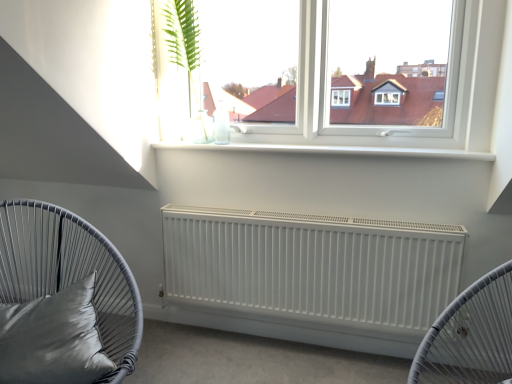
Identify the location of green leafy plant at upper center. (183, 38).

What is the approximate height of satin gray pillow at lower left?

The height of satin gray pillow at lower left is 11.37 inches.

What do you see at coordinates (53, 339) in the screenshot?
I see `satin gray pillow at lower left` at bounding box center [53, 339].

Where is `green leafy plant at upper center`? green leafy plant at upper center is located at coordinates (183, 38).

Is matte gray cushion at left not within satin gray pillow at lower left?

Yes, matte gray cushion at left is outside of satin gray pillow at lower left.

Which is more distant, (6, 226) or (0, 346)?

The point (6, 226) is more distant.

Considering the sizes of matte gray cushion at left and satin gray pillow at lower left in the image, is matte gray cushion at left wider or thinner than satin gray pillow at lower left?

Clearly, matte gray cushion at left has more width compared to satin gray pillow at lower left.

Is green leafy plant at upper center surrounded by matte gray cushion at left?

No, green leafy plant at upper center is not a part of matte gray cushion at left.

Is point (120, 365) behind point (180, 41)?

That is False.

Find the location of `furniture located on the left of green leafy plant at upper center`. furniture located on the left of green leafy plant at upper center is located at coordinates 71,273.

How many degrees apart are the facing directions of matte gray cushion at left and green leafy plant at upper center?

A: 48.2 degrees.

From a real-world perspective, which is physically above, green leafy plant at upper center or satin gray pillow at lower left?

In real-world perspective, green leafy plant at upper center is above.

Is green leafy plant at upper center thinner than satin gray pillow at lower left?

Indeed, green leafy plant at upper center has a lesser width compared to satin gray pillow at lower left.

Between green leafy plant at upper center and satin gray pillow at lower left, which one is positioned behind?

Positioned behind is green leafy plant at upper center.

Can you tell me how much green leafy plant at upper center and satin gray pillow at lower left differ in facing direction?

The facing directions of green leafy plant at upper center and satin gray pillow at lower left are 37 degrees apart.

Measure the distance from satin gray pillow at lower left to matte gray cushion at left.

The distance of satin gray pillow at lower left from matte gray cushion at left is 5.60 inches.

From a real-world perspective, which object stands above the other?

satin gray pillow at lower left, from a real-world perspective.

Is satin gray pillow at lower left oriented towards matte gray cushion at left?

Yes, satin gray pillow at lower left is turned towards matte gray cushion at left.

From the image's perspective, is satin gray pillow at lower left located above matte gray cushion at left?

Yes, from the image's perspective, satin gray pillow at lower left is on top of matte gray cushion at left.

Considering the relative sizes of white matte radiator at center and matte gray cushion at left in the image provided, is white matte radiator at center smaller than matte gray cushion at left?

Correct, white matte radiator at center occupies less space than matte gray cushion at left.

Does point (345, 243) lie in front of point (52, 292)?

No, (345, 243) is behind (52, 292).

Considering the relative sizes of white matte radiator at center and matte gray cushion at left in the image provided, is white matte radiator at center wider than matte gray cushion at left?

Incorrect, the width of white matte radiator at center does not surpass that of matte gray cushion at left.

Is matte gray cushion at left completely or partially inside white matte radiator at center?

Definitely not — matte gray cushion at left is not inside white matte radiator at center.

From the image's perspective, is green leafy plant at upper center over white matte radiator at center?

Yes, from the image's perspective, green leafy plant at upper center is over white matte radiator at center.

Can you tell me how much green leafy plant at upper center and white matte radiator at center differ in facing direction?

Result: The angle between the facing direction of green leafy plant at upper center and the facing direction of white matte radiator at center is 0.515 degrees.

At what (x,y) coordinates should I click in order to perform the action: click on plant above the white matte radiator at center (from a real-world perspective). Please return your answer as a coordinate pair (x, y). This screenshot has width=512, height=384. Looking at the image, I should click on (183, 38).

Can you confirm if green leafy plant at upper center is shorter than white matte radiator at center?

Incorrect, the height of green leafy plant at upper center does not fall short of that of white matte radiator at center.

From the image's perspective, is green leafy plant at upper center under matte gray cushion at left?

No, from the image's perspective, green leafy plant at upper center is not below matte gray cushion at left.

Is green leafy plant at upper center surrounding matte gray cushion at left?

No.

From the picture: Considering the relative sizes of green leafy plant at upper center and matte gray cushion at left in the image provided, is green leafy plant at upper center thinner than matte gray cushion at left?

Indeed, green leafy plant at upper center has a lesser width compared to matte gray cushion at left.

Is green leafy plant at upper center far from matte gray cushion at left?

green leafy plant at upper center is positioned a significant distance from matte gray cushion at left.

Locate an element on the screen. Image resolution: width=512 pixels, height=384 pixels. furniture below the satin gray pillow at lower left (from a real-world perspective) is located at coordinates (71, 273).

This screenshot has width=512, height=384. Identify the location of plant that appears above the matte gray cushion at left (from the image's perspective). (183, 38).

Based on their spatial positions, is white matte radiator at center or satin gray pillow at lower left further from matte gray cushion at left?

white matte radiator at center is further to matte gray cushion at left.

Considering their positions, is matte gray cushion at left positioned closer to green leafy plant at upper center than satin gray pillow at lower left?

matte gray cushion at left is closer to green leafy plant at upper center.

Considering their positions, is white matte radiator at center positioned further to satin gray pillow at lower left than matte gray cushion at left?

white matte radiator at center is positioned further to the anchor satin gray pillow at lower left.

Estimate the real-world distances between objects in this image. Which object is closer to green leafy plant at upper center, white matte radiator at center or matte gray cushion at left?

white matte radiator at center lies closer to green leafy plant at upper center than the other object.

Looking at the image, which one is located further to white matte radiator at center, green leafy plant at upper center or satin gray pillow at lower left?

green leafy plant at upper center.

From the image, which object appears to be farther from matte gray cushion at left, white matte radiator at center or green leafy plant at upper center?

green leafy plant at upper center.

Based on their spatial positions, is matte gray cushion at left or satin gray pillow at lower left closer to white matte radiator at center?

Among the two, matte gray cushion at left is located nearer to white matte radiator at center.

Looking at the image, which one is located closer to satin gray pillow at lower left, matte gray cushion at left or white matte radiator at center?

Among the two, matte gray cushion at left is located nearer to satin gray pillow at lower left.

I want to click on radiator between green leafy plant at upper center and satin gray pillow at lower left vertically, so click(313, 269).

Image resolution: width=512 pixels, height=384 pixels. I want to click on furniture between satin gray pillow at lower left and white matte radiator at center, so click(71, 273).

The height and width of the screenshot is (384, 512). Identify the location of radiator that lies between green leafy plant at upper center and matte gray cushion at left from top to bottom. (313, 269).

You are a GUI agent. You are given a task and a screenshot of the screen. Output one action in this format:
    pyautogui.click(x=<x>, y=<y>)
    Task: Click on the pillow between green leafy plant at upper center and matte gray cushion at left from top to bottom
    Image resolution: width=512 pixels, height=384 pixels.
    Given the screenshot: What is the action you would take?
    pyautogui.click(x=53, y=339)